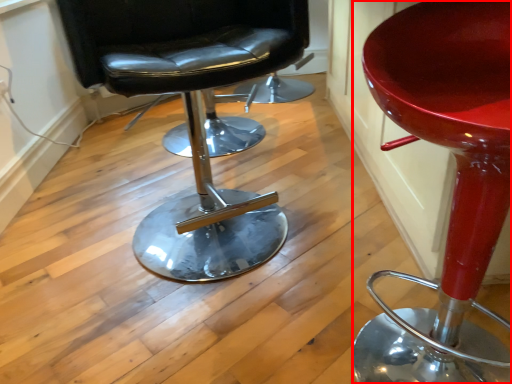
Question: From the image's perspective, what is the correct spatial relationship of chair (annotated by the red box) in relation to chair?

Choices:
 (A) below
 (B) above

Answer: (A)